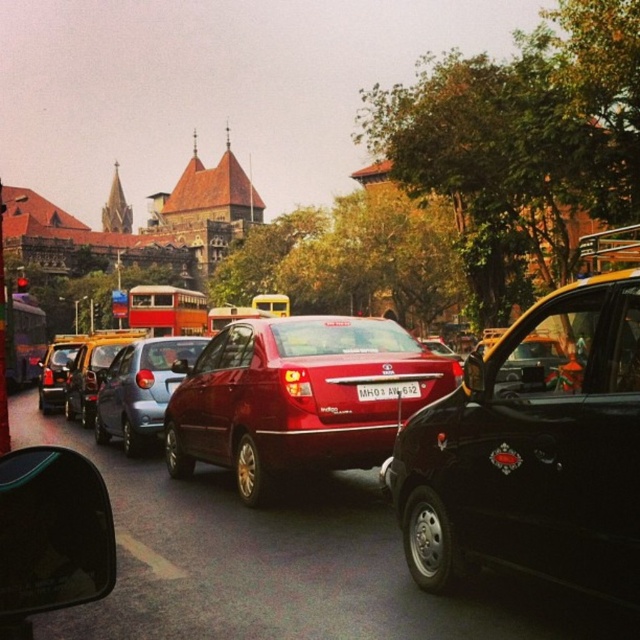
You are a delivery driver who needs to park your 1.8 meters wide van. You see the shiny red sedan at center and the matte black car at left. Which vehicle has enough space for your van to park next to it without overlapping?

The matte black car at left has a width greater than the shiny red sedan at center. Since your van is 1.8 meters wide, you should check the width of the matte black car at left. If it is wider than 1.8 meters, then it can accommodate your van. However, based on the information provided, the shiny red sedan at center is narrower than the matte black car at left. Without exact measurements, it is uncertain if either can fit your van. Please verify the exact width of the matte black car at left before deciding

You are a pedestrian waiting to cross the street. You see the satin red sedan at center and the metallic silver taxi at center. Which vehicle is closer to you?

The satin red sedan at center is closer to you because it is in front of the metallic silver taxi at center.

You are a pedestrian standing at the crosswalk in the middle of the street. You see the satin red sedan at center and the metallic silver taxi at center. Which vehicle is closer to the ground?

The satin red sedan at center is closer to the ground because it is located below the metallic silver taxi at center.